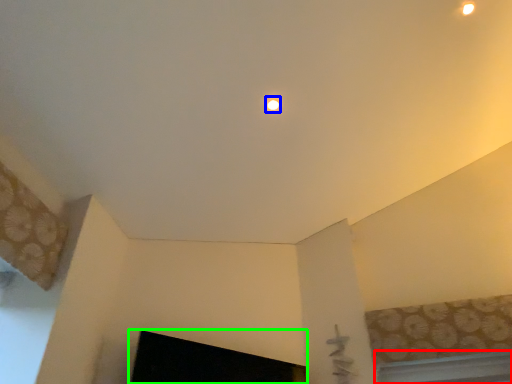
Question: Which is farther away from window (highlighted by a red box)? lighting (highlighted by a blue box) or fireplace (highlighted by a green box)?

Choices:
 (A) lighting
 (B) fireplace

Answer: (A)